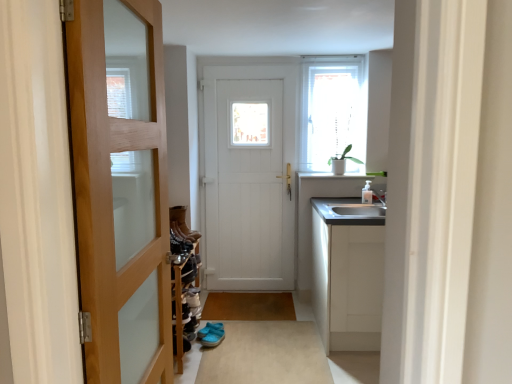
Identify the location of free space in front of blue fabric sandals at center. (216, 347).